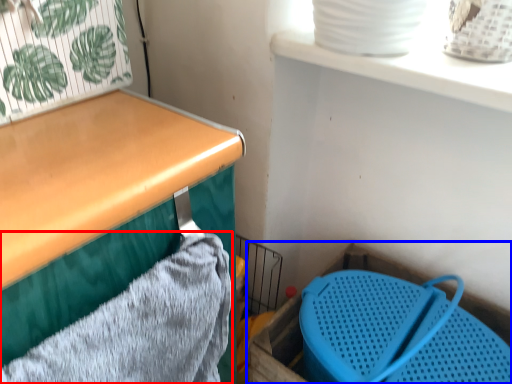
Question: Which point is closer to the camera, bath towel (highlighted by a red box) or storage box (highlighted by a blue box)?

Choices:
 (A) bath towel
 (B) storage box

Answer: (A)